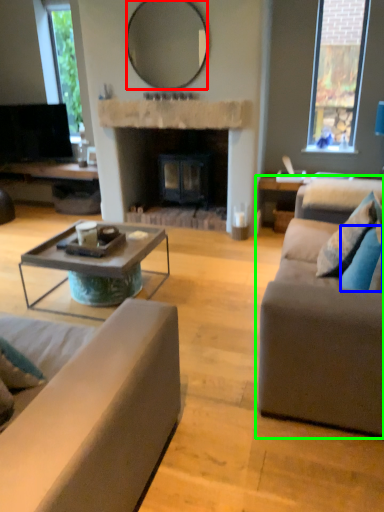
Question: Which is farther away from mirror (highlighted by a red box)? pillow (highlighted by a blue box) or studio couch (highlighted by a green box)?

Choices:
 (A) pillow
 (B) studio couch

Answer: (B)